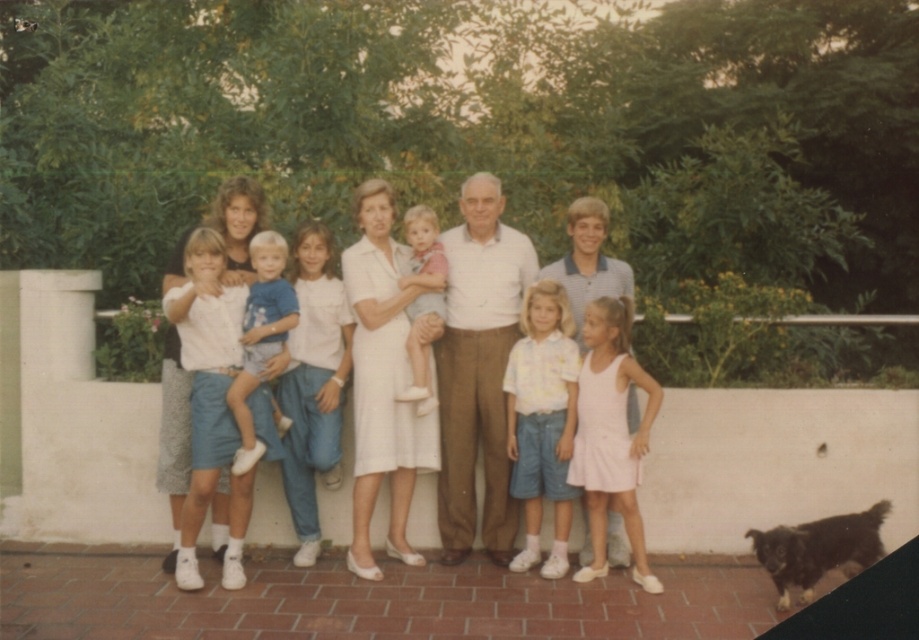
Question: Can you confirm if white cotton dress at center is wider than yellow floral shirt at center?

Choices:
 (A) yes
 (B) no

Answer: (A)

Question: Which point is closer to the camera?

Choices:
 (A) 392,461
 (B) 256,317

Answer: (B)

Question: Does blue denim shorts at center appear on the left side of light pink fabric baby at center?

Choices:
 (A) no
 (B) yes

Answer: (B)

Question: Among these points, which one is nearest to the camera?

Choices:
 (A) (278, 294)
 (B) (359, 259)
 (C) (443, 532)
 (D) (496, 461)

Answer: (A)

Question: Which of the following is the farthest from the observer?

Choices:
 (A) yellow floral shirt at center
 (B) white fabric dress at center

Answer: (A)

Question: Does yellow floral shirt at center have a smaller size compared to blue denim shorts at center?

Choices:
 (A) yes
 (B) no

Answer: (B)